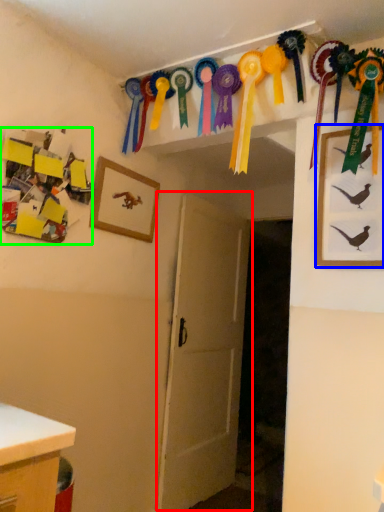
Question: Estimate the real-world distances between objects in this image. Which object is farther from door (highlighted by a red box), picture frame (highlighted by a blue box) or art (highlighted by a green box)?

Choices:
 (A) picture frame
 (B) art

Answer: (A)